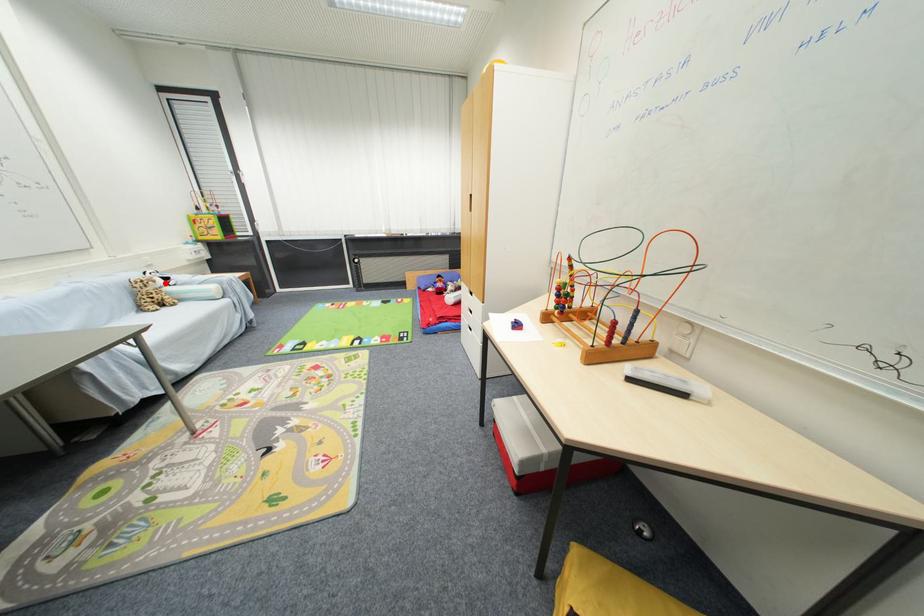
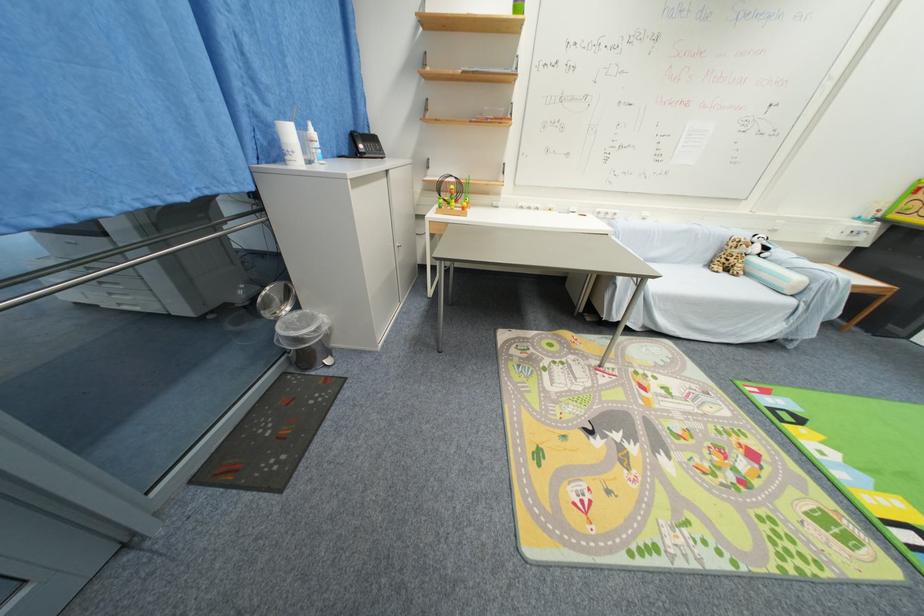
Where in the second image is the point corresponding to the highlighted location from the first image?

(761, 251)